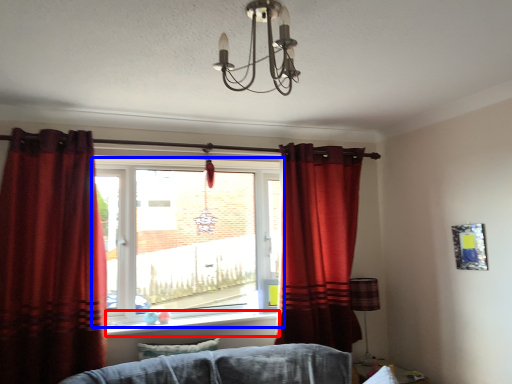
Question: Which of the following is the closest to the observer, window sill (highlighted by a red box) or window (highlighted by a blue box)?

Choices:
 (A) window sill
 (B) window

Answer: (A)